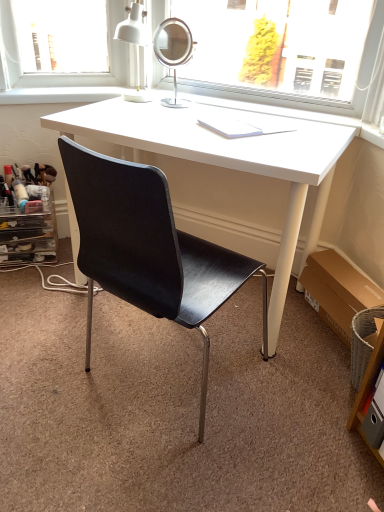
The width and height of the screenshot is (384, 512). Find the location of `vacant space in between white glossy desk at center and brown cardboard box at lower right`. vacant space in between white glossy desk at center and brown cardboard box at lower right is located at coordinates (304, 348).